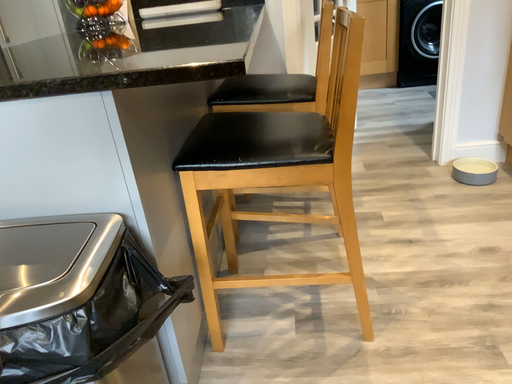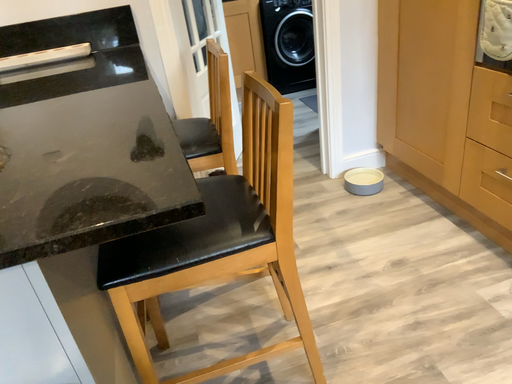
Question: Which way did the camera rotate in the video?

Choices:
 (A) rotated right
 (B) rotated left

Answer: (A)